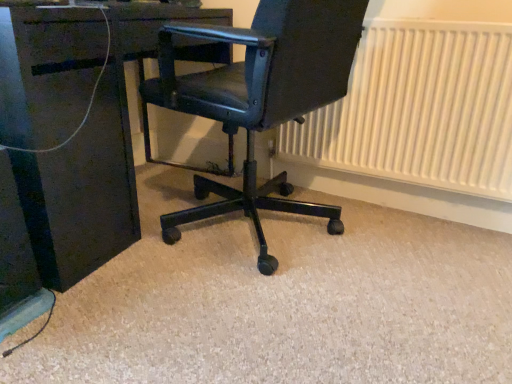
Identify the location of white textured radiator at right. This screenshot has width=512, height=384. (420, 109).

Is point (463, 70) closer or farther from the camera than point (326, 4)?

Point (463, 70) is farther from the camera than point (326, 4).

Looking at this image, from their relative heights in the image, would you say white textured radiator at right is taller or shorter than matte black office chair at center?

Considering their sizes, white textured radiator at right has less height than matte black office chair at center.

Is matte black office chair at center located within white textured radiator at right?

No.

Is white textured radiator at right thinner than matte black office chair at center?

Indeed, white textured radiator at right has a lesser width compared to matte black office chair at center.

Between matte black desk at center and matte black office chair at center, which one appears on the left side from the viewer's perspective?

matte black desk at center.

Is matte black desk at center oriented away from matte black office chair at center?

Yes, matte black desk at center is positioned with its back facing matte black office chair at center.

Considering the sizes of objects matte black desk at center and matte black office chair at center in the image provided, who is wider, matte black desk at center or matte black office chair at center?

With larger width is matte black office chair at center.

From the picture: Is matte black desk at center closer to camera compared to matte black office chair at center?

No, matte black desk at center is further to the viewer.

From the image's perspective, does white textured radiator at right appear lower than matte black desk at center?

Yes.

Is white textured radiator at right oriented towards matte black desk at center?

No, white textured radiator at right is not turned towards matte black desk at center.

In terms of width, does white textured radiator at right look wider or thinner when compared to matte black desk at center?

In the image, white textured radiator at right appears to be more narrow than matte black desk at center.

The width and height of the screenshot is (512, 384). What are the coordinates of `chair above the matte black desk at center (from a real-world perspective)` in the screenshot? It's located at (260, 97).

Between matte black office chair at center and matte black desk at center, which one is positioned behind?

matte black desk at center is further from the camera.

Which point is more forward, [358,29] or [84,64]?

The point [84,64] is more forward.

Does matte black office chair at center have a larger size compared to matte black desk at center?

No.

Is matte black office chair at center oriented away from white textured radiator at right?

matte black office chair at center is not turned away from white textured radiator at right.

Is point (276, 66) closer or farther from the camera than point (324, 117)?

Point (276, 66) is closer to the camera than point (324, 117).

How many degrees apart are the facing directions of matte black office chair at center and white textured radiator at right?

They differ by 95.6 degrees in their facing directions.

From a real-world perspective, is matte black office chair at center positioned under white textured radiator at right based on gravity?

No.

From the image's perspective, would you say matte black desk at center is positioned over white textured radiator at right?

Yes, from the image's perspective, matte black desk at center is above white textured radiator at right.

Considering the sizes of matte black desk at center and white textured radiator at right in the image, is matte black desk at center taller or shorter than white textured radiator at right?

Considering their sizes, matte black desk at center has more height than white textured radiator at right.

Which object is thinner, matte black desk at center or white textured radiator at right?

Thinner between the two is white textured radiator at right.

In the image, there is a white textured radiator at right. At what (x,y) coordinates should I click in order to perform the action: click on chair below it (from the image's perspective). Please return your answer as a coordinate pair (x, y). Looking at the image, I should click on (260, 97).

In order to click on desk above the matte black office chair at center (from the image's perspective) in this screenshot , I will do `click(95, 161)`.

Looking at the image, which one is located closer to white textured radiator at right, matte black desk at center or matte black office chair at center?

Based on the image, matte black office chair at center appears to be nearer to white textured radiator at right.

When comparing their distances from matte black office chair at center, does white textured radiator at right or matte black desk at center seem closer?

matte black desk at center is positioned closer to the anchor matte black office chair at center.

Considering their positions, is matte black office chair at center positioned closer to matte black desk at center than white textured radiator at right?

matte black office chair at center is closer to matte black desk at center.

Looking at the image, which one is located further to matte black desk at center, white textured radiator at right or matte black office chair at center?

The object further to matte black desk at center is white textured radiator at right.

When comparing their distances from matte black office chair at center, does matte black desk at center or white textured radiator at right seem closer?

matte black desk at center.

From the image, which object appears to be nearer to white textured radiator at right, matte black office chair at center or matte black desk at center?

matte black office chair at center is positioned closer to the anchor white textured radiator at right.

The width and height of the screenshot is (512, 384). I want to click on chair between matte black desk at center and white textured radiator at right in the horizontal direction, so click(260, 97).